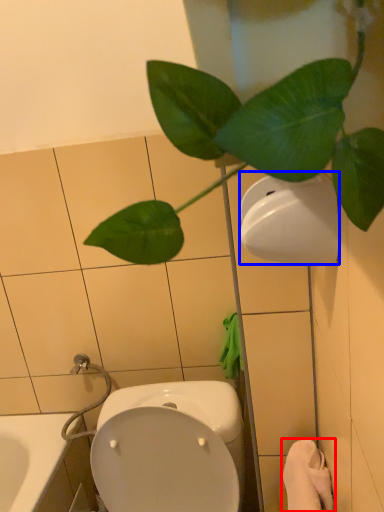
Question: Among these objects, which one is farthest to the camera, bath towel (highlighted by a red box) or toilet paper (highlighted by a blue box)?

Choices:
 (A) bath towel
 (B) toilet paper

Answer: (A)